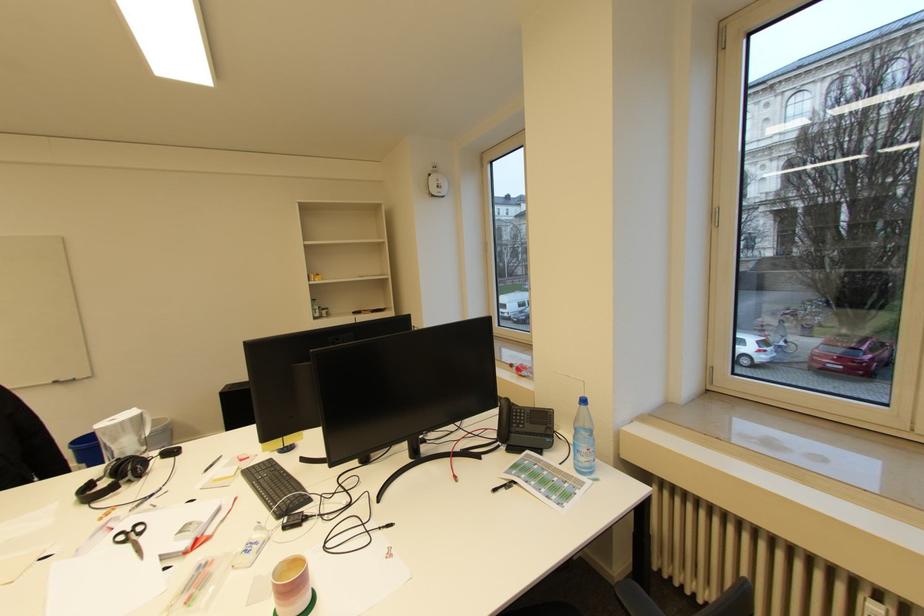
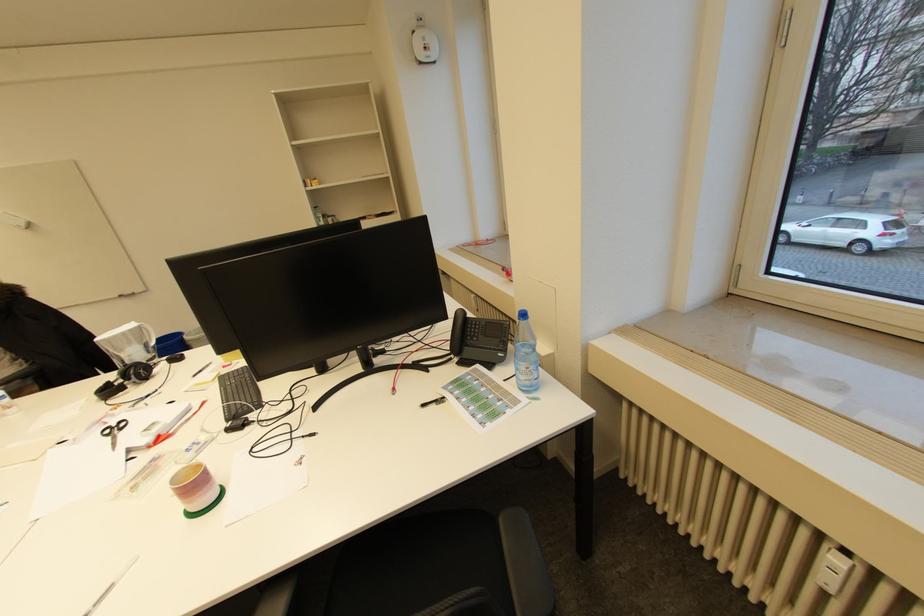
The point at (141, 525) is marked in the first image. Where is the corresponding point in the second image?

(127, 422)